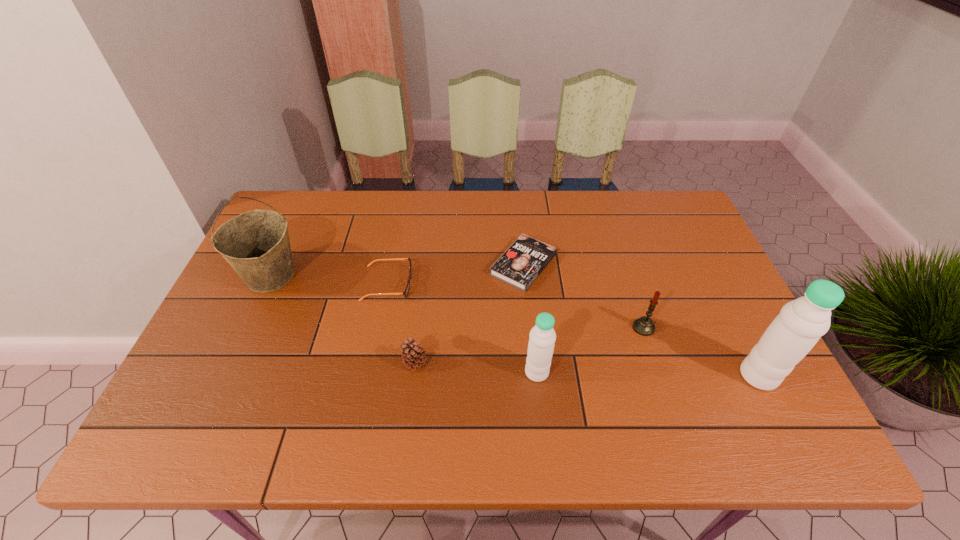
The width and height of the screenshot is (960, 540). Find the location of `object located in the left edge section of the desktop`. object located in the left edge section of the desktop is located at coordinates (256, 244).

I want to click on object that is at the right edge, so click(793, 333).

Identify the location of object that is positioned at the near right corner. (793, 333).

Where is `vacant space at the far edge`? The width and height of the screenshot is (960, 540). vacant space at the far edge is located at coordinates (532, 206).

In the image, there is a desktop. Identify the location of free space at the near edge. (274, 398).

Identify the location of blank space at the left edge of the desktop. (303, 245).

What are the coordinates of `vacant region at the far left corner` in the screenshot? It's located at (301, 199).

The image size is (960, 540). I want to click on vacant area at the far right corner, so click(x=639, y=206).

Identify the location of free space between the fourth nearest object and the book. (584, 296).

At what (x,y) coordinates should I click in order to perform the action: click on free point between the third tallest object and the sixth object from right to left. Please return your answer as a coordinate pair (x, y). This screenshot has width=960, height=540. Looking at the image, I should click on (462, 328).